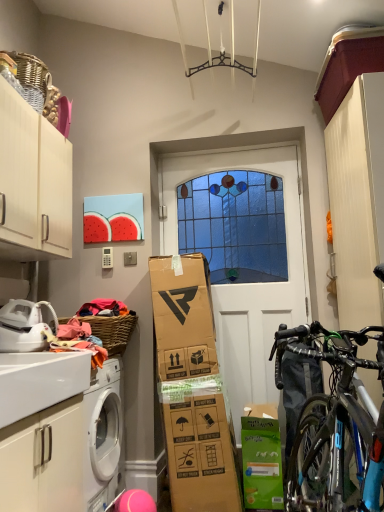
Question: In the image, is white matte cabinet at lower left, the second cabinetry positioned from the top, positioned in front of or behind white matte door at center?

Choices:
 (A) behind
 (B) front

Answer: (B)

Question: In terms of size, does white matte cabinet at lower left, the second cabinetry positioned from the top, appear bigger or smaller than white matte door at center?

Choices:
 (A) small
 (B) big

Answer: (A)

Question: Which of these objects is positioned closest to the green matte cardboard box at lower center?

Choices:
 (A) white matte cabinet at lower left, arranged as the first cabinetry when ordered from the bottom
 (B) white glossy countertop at lower left
 (C) shiny black bicycle at right
 (D) white matte cabinet at upper left, marked as the second cabinetry in a bottom-to-top arrangement
 (E) white matte door at center

Answer: (C)

Question: Estimate the real-world distances between objects in this image. Which object is farther from the woven brown basket at upper left?

Choices:
 (A) white glossy countertop at lower left
 (B) shiny black bicycle at right
 (C) green matte cardboard box at lower center
 (D) white matte door at center
 (E) white matte cabinet at upper left, marked as the second cabinetry in a bottom-to-top arrangement

Answer: (B)